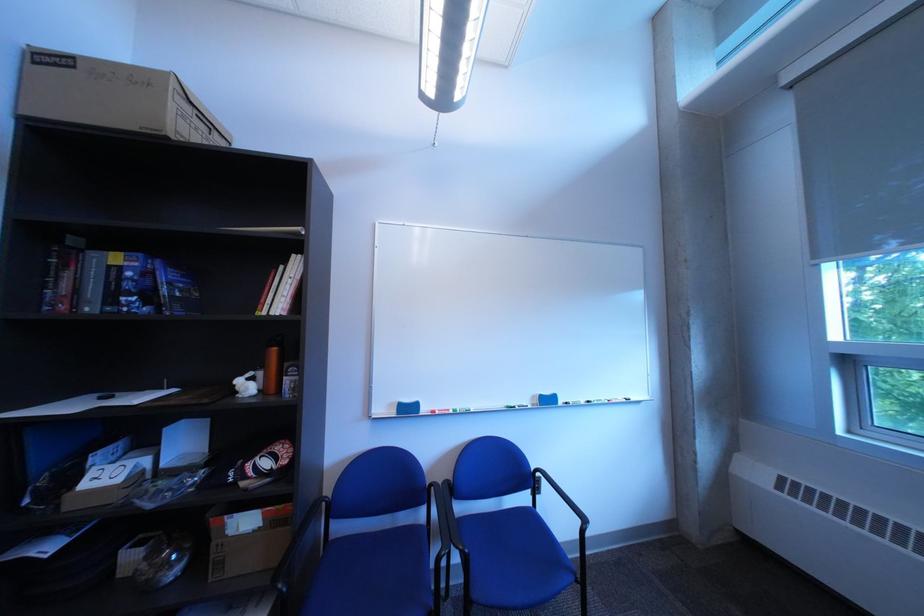
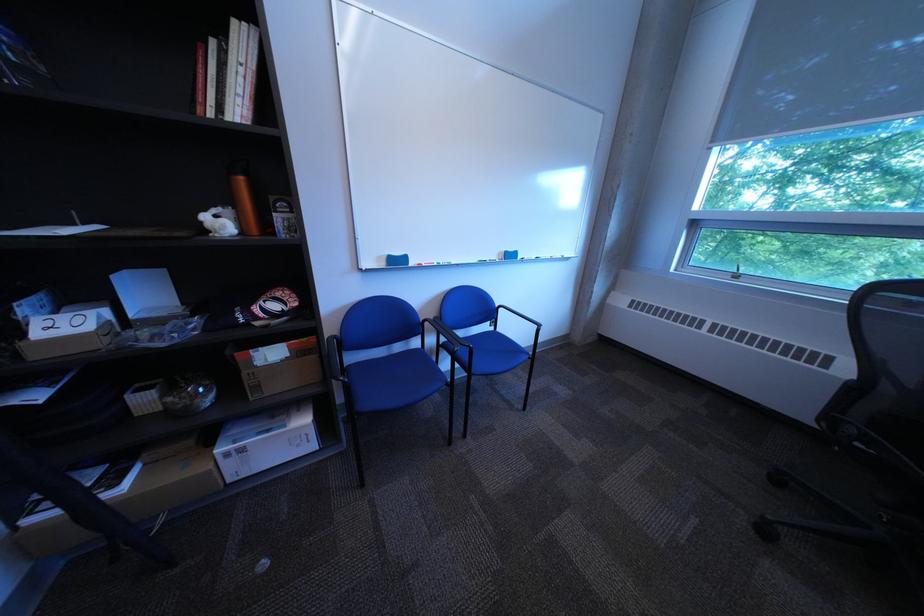
Based on the continuous images, in which direction is the camera rotating?

The camera's rotation is toward right-down.